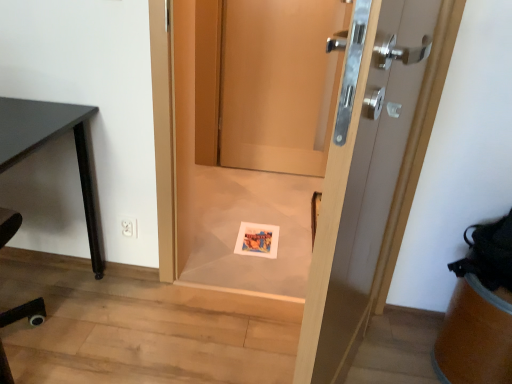
Question: From the image's perspective, does matte black desk at left appear lower than matte wood door at center, marked as the 2th door in a front-to-back arrangement?

Choices:
 (A) no
 (B) yes

Answer: (B)

Question: Is matte black desk at left looking in the opposite direction of matte wood door at center, marked as the 2th door in a front-to-back arrangement?

Choices:
 (A) yes
 (B) no

Answer: (B)

Question: From a real-world perspective, does matte black desk at left stand above matte wood door at center, positioned as the 2th door in back-to-front order?

Choices:
 (A) yes
 (B) no

Answer: (B)

Question: Can you confirm if matte black desk at left is shorter than matte wood door at center, marked as the 2th door in a front-to-back arrangement?

Choices:
 (A) no
 (B) yes

Answer: (B)

Question: Is matte black desk at left oriented towards matte wood door at center, positioned as the 2th door in back-to-front order?

Choices:
 (A) yes
 (B) no

Answer: (B)

Question: Is matte black desk at left outside matte wood door at center, positioned as the 2th door in back-to-front order?

Choices:
 (A) no
 (B) yes

Answer: (B)

Question: Considering the relative sizes of wooden door at center, the third door positioned from the front, and matte black desk at left in the image provided, is wooden door at center, the third door positioned from the front, thinner than matte black desk at left?

Choices:
 (A) yes
 (B) no

Answer: (A)

Question: From a real-world perspective, is wooden door at center, the first door in the back-to-front sequence, over matte black desk at left?

Choices:
 (A) no
 (B) yes

Answer: (B)

Question: Does wooden door at center, the third door positioned from the front, appear on the right side of matte black desk at left?

Choices:
 (A) no
 (B) yes

Answer: (B)

Question: Is wooden door at center, the third door positioned from the front, taller than matte black desk at left?

Choices:
 (A) yes
 (B) no

Answer: (A)

Question: Considering the relative sizes of wooden door at center, the first door in the back-to-front sequence, and matte black desk at left in the image provided, is wooden door at center, the first door in the back-to-front sequence, wider than matte black desk at left?

Choices:
 (A) yes
 (B) no

Answer: (B)

Question: Is wooden door at center, the first door in the back-to-front sequence, closer to camera compared to matte black desk at left?

Choices:
 (A) no
 (B) yes

Answer: (A)

Question: From the image's perspective, does white plastic electric outlet at lower left appear higher than wooden door at center, the first door in the back-to-front sequence?

Choices:
 (A) yes
 (B) no

Answer: (B)